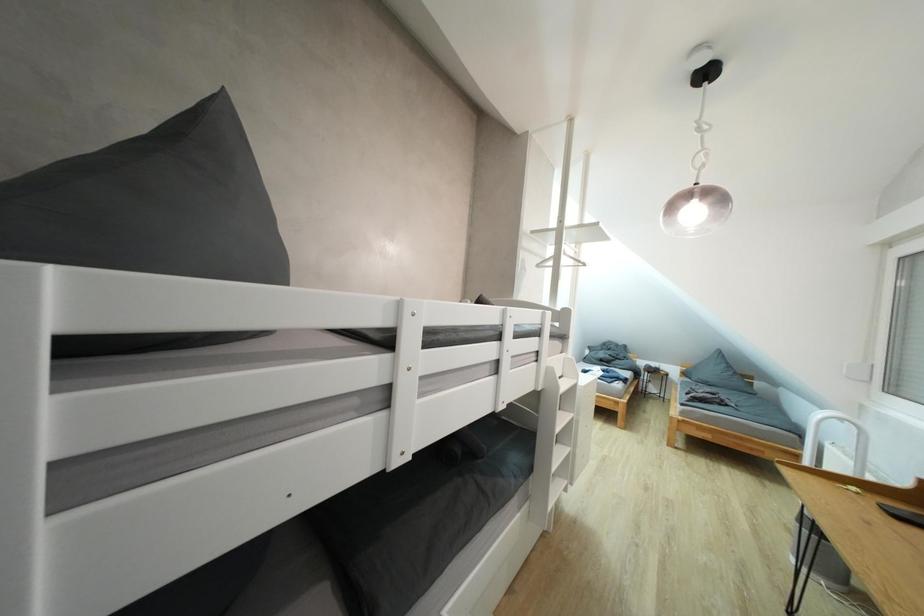
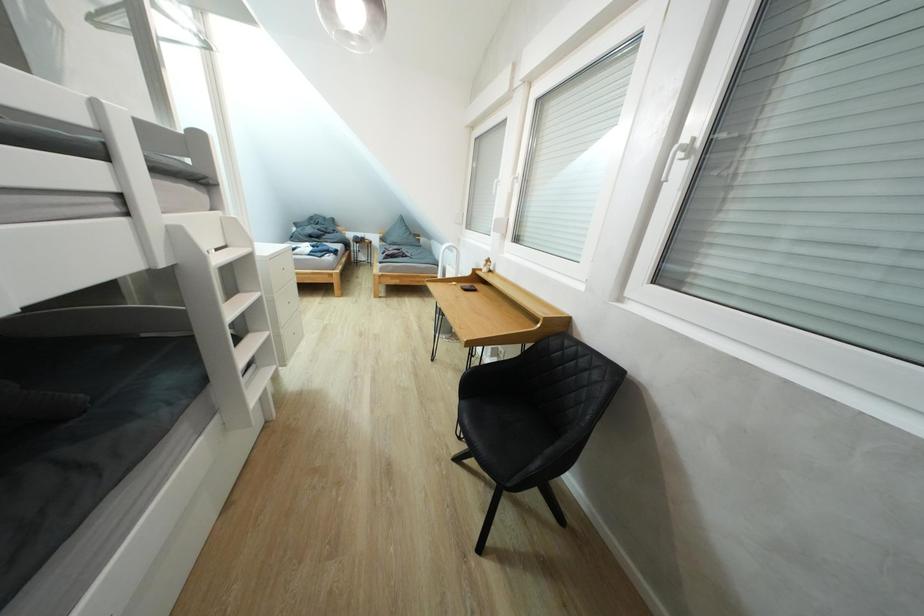
Based on the continuous images, in which direction is the camera rotating?

The camera's rotation is toward right-down.